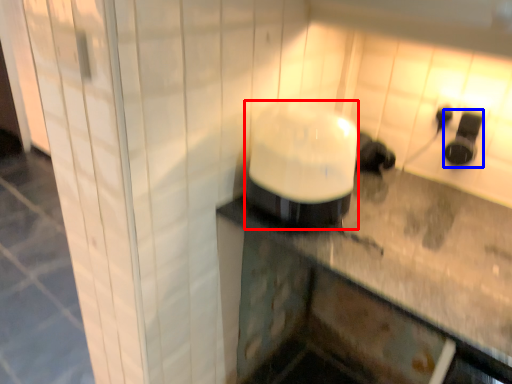
Question: Which object appears farthest to the camera in this image, appliance (highlighted by a red box) or appliance (highlighted by a blue box)?

Choices:
 (A) appliance
 (B) appliance

Answer: (B)